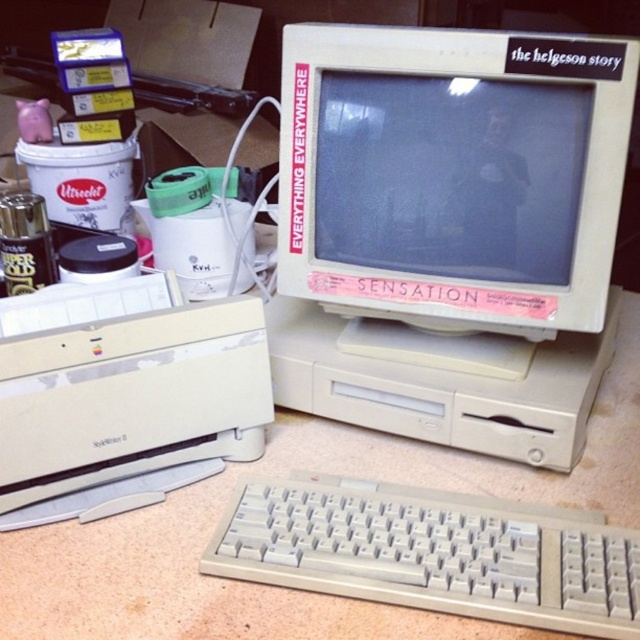
You are a technician who needs to locate the white plastic monitor at center in the vintage computer setup. According to the coordinates provided, where exactly would you find it?

The white plastic monitor at center is located at point (452, 173).

You are setting up a new desk and want to place a lamp to illuminate both the white plastic monitor at center and the white plastic printer at lower left. Based on their positions, where should you place the lamp to ensure both are well lit?

The white plastic monitor at center is located above the white plastic printer at lower left, so placing the lamp between them or slightly above the monitor would ensure both are well lit.

You are setting up a vintage computer station and need to place the white plastic monitor at center and the white plastic keyboard at lower center. According to the image, which object is placed above the other?

The white plastic monitor at center is positioned over the white plastic keyboard at lower center, so the monitor is placed above the keyboard.